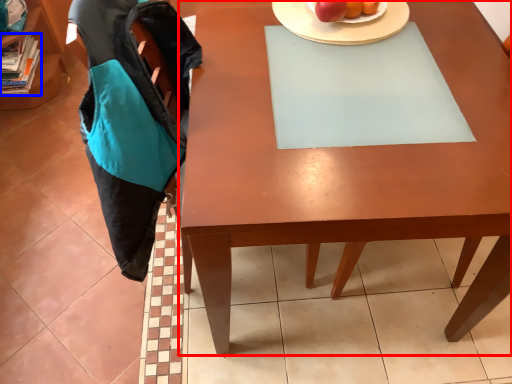
Question: Which point is closer to the camera, desk (highlighted by a red box) or book (highlighted by a blue box)?

Choices:
 (A) desk
 (B) book

Answer: (A)